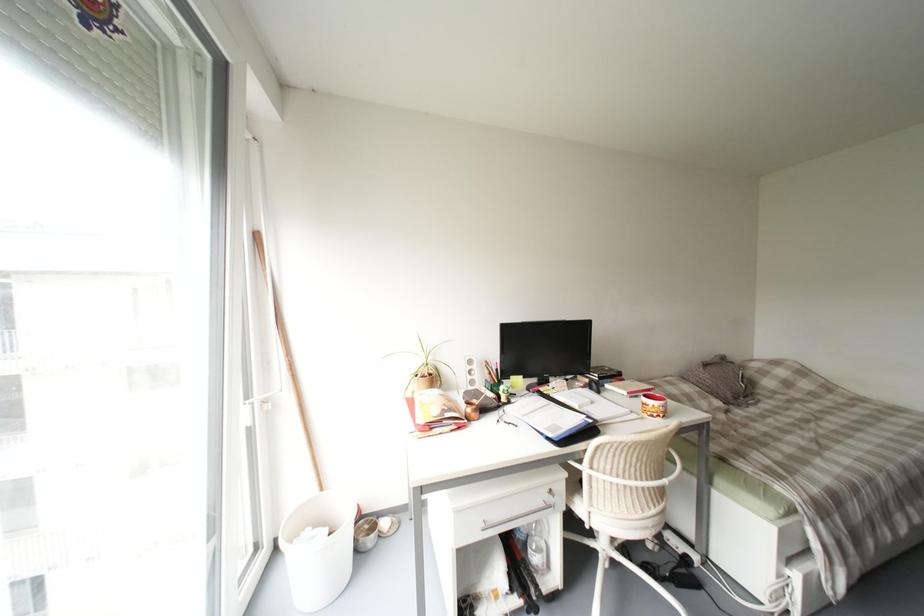
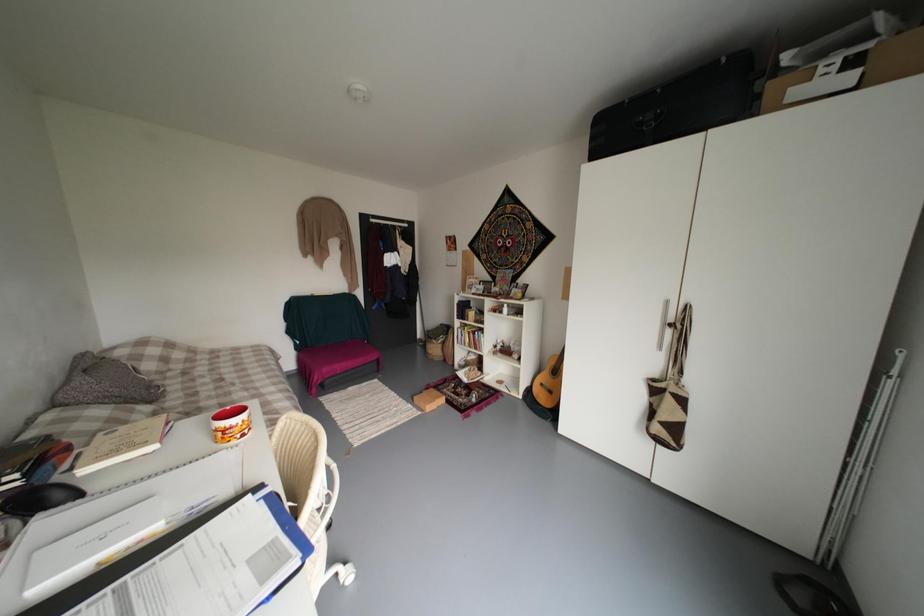
Question: The camera is either moving clockwise (left) or counter-clockwise (right) around the object. The first image is from the beginning of the video and the second image is from the end. Is the camera moving left or right when shooting the video?

Choices:
 (A) Left
 (B) Right

Answer: (A)